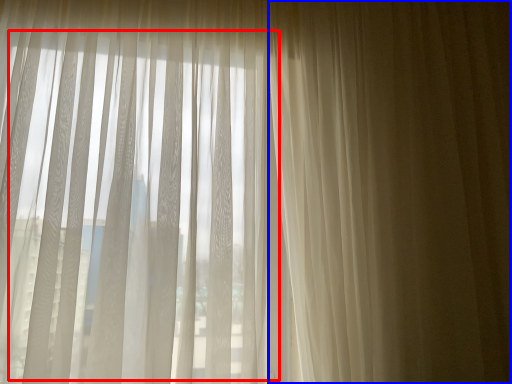
Question: Among these objects, which one is farthest to the camera, bay window (highlighted by a red box) or curtain (highlighted by a blue box)?

Choices:
 (A) bay window
 (B) curtain

Answer: (B)